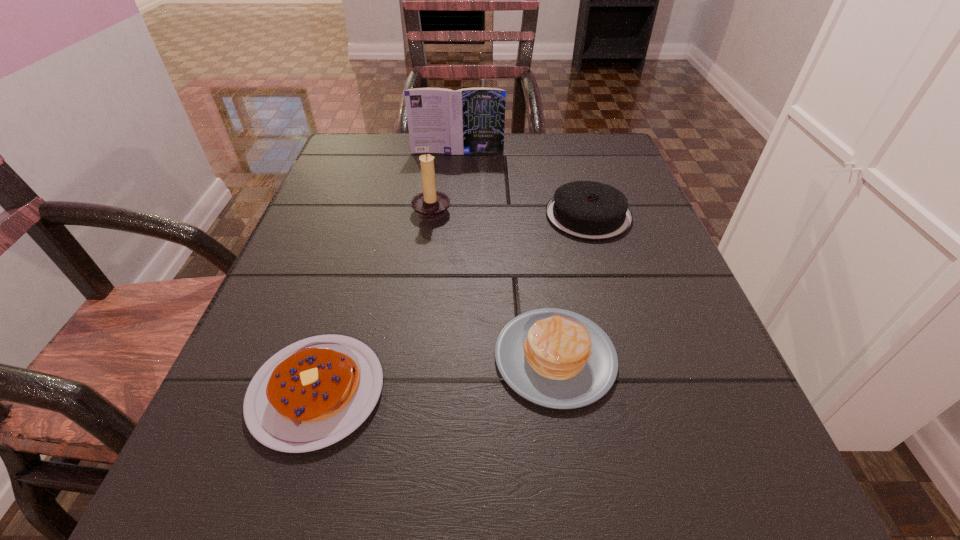
Find the location of a particular element. The image size is (960, 540). vacant area in the image that satisfies the following two spatial constraints: 1. on the front cover of the book; 2. on the right side of the farthest pancake is located at coordinates pyautogui.click(x=453, y=215).

Locate an element on the screen. This screenshot has height=540, width=960. free space that satisfies the following two spatial constraints: 1. on the back side of the farthest pancake; 2. on the wick of the second tallest object is located at coordinates (587, 208).

You are a GUI agent. You are given a task and a screenshot of the screen. Output one action in this format:
    pyautogui.click(x=<x>, y=<y>)
    Task: Click on the free location that satisfies the following two spatial constraints: 1. on the wick of the second tallest object; 2. on the left side of the farthest pancake
    This screenshot has width=960, height=540.
    Given the screenshot: What is the action you would take?
    pyautogui.click(x=431, y=215)